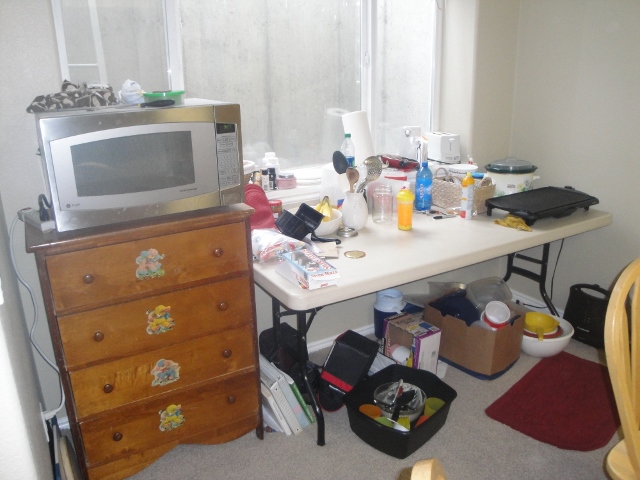
At what (x,y) coordinates should I click in order to perform the action: click on floor. Please return your answer as a coordinate pair (x, y). This screenshot has height=480, width=640. Looking at the image, I should click on (493, 458).